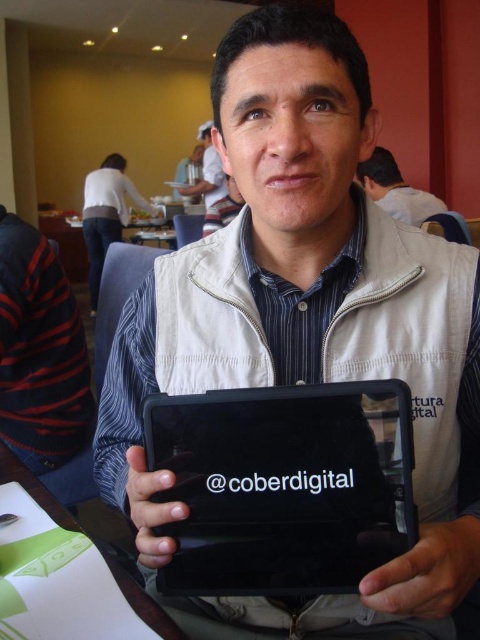
Question: Which object appears closest to the camera in this image?

Choices:
 (A) black matte sweater at left
 (B) matte white tablet at center

Answer: (A)

Question: From the image, what is the correct spatial relationship of black matte tablet at center in relation to green plastic table at lower left?

Choices:
 (A) left
 (B) right

Answer: (B)

Question: Which of these objects is positioned closest to the matte white shirt at upper center?

Choices:
 (A) matte white tablet at center
 (B) black matte tablet at center
 (C) black matte sweater at left

Answer: (A)

Question: Is matte white tablet at upper center wider than matte white tablet at center?

Choices:
 (A) yes
 (B) no

Answer: (A)

Question: Which of the following is the closest to the observer?

Choices:
 (A) (175, 452)
 (B) (182, 193)

Answer: (A)

Question: Considering the relative positions of matte white shirt at upper center and matte white tablet at center in the image provided, where is matte white shirt at upper center located with respect to matte white tablet at center?

Choices:
 (A) left
 (B) right

Answer: (A)